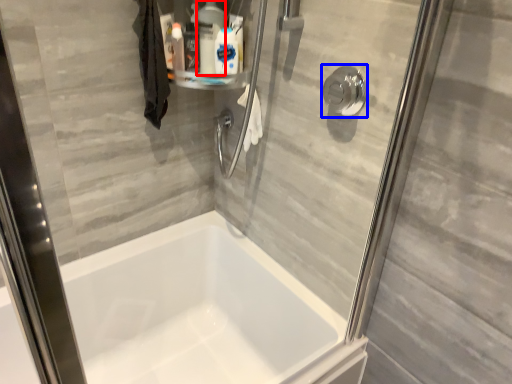
Question: Which object is further to the camera taking this photo, cleaning product (highlighted by a red box) or shower (highlighted by a blue box)?

Choices:
 (A) cleaning product
 (B) shower

Answer: (A)